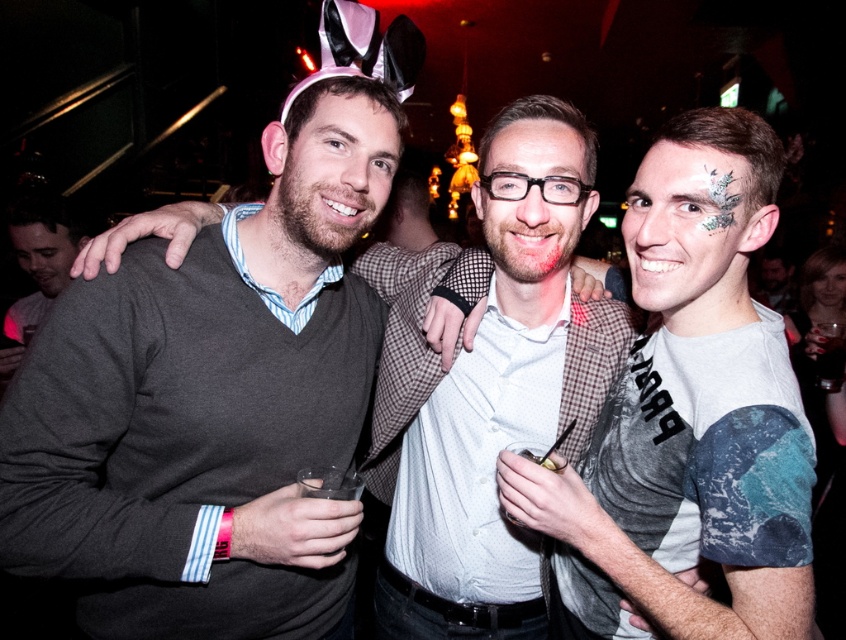
Question: Is dark gray sweater at center to the left of white textured shirt at center from the viewer's perspective?

Choices:
 (A) no
 (B) yes

Answer: (B)

Question: Which of these objects is positioned closest to the matte gray sweater at center?

Choices:
 (A) white textured shirt at center
 (B) gray matte t-shirt at center
 (C) dark gray sweater at center

Answer: (C)

Question: Does dark gray sweater at center appear under matte gray sweater at center?

Choices:
 (A) no
 (B) yes

Answer: (B)

Question: Which object is the farthest from the matte gray sweater at center?

Choices:
 (A) dark gray sweater at center
 (B) white textured shirt at center
 (C) gray matte t-shirt at center

Answer: (C)

Question: Which object appears closest to the camera in this image?

Choices:
 (A) white textured shirt at center
 (B) matte gray sweater at center
 (C) gray matte t-shirt at center
 (D) dark gray sweater at center

Answer: (C)

Question: Where is dark gray sweater at center located in relation to matte gray sweater at center in the image?

Choices:
 (A) below
 (B) above

Answer: (A)